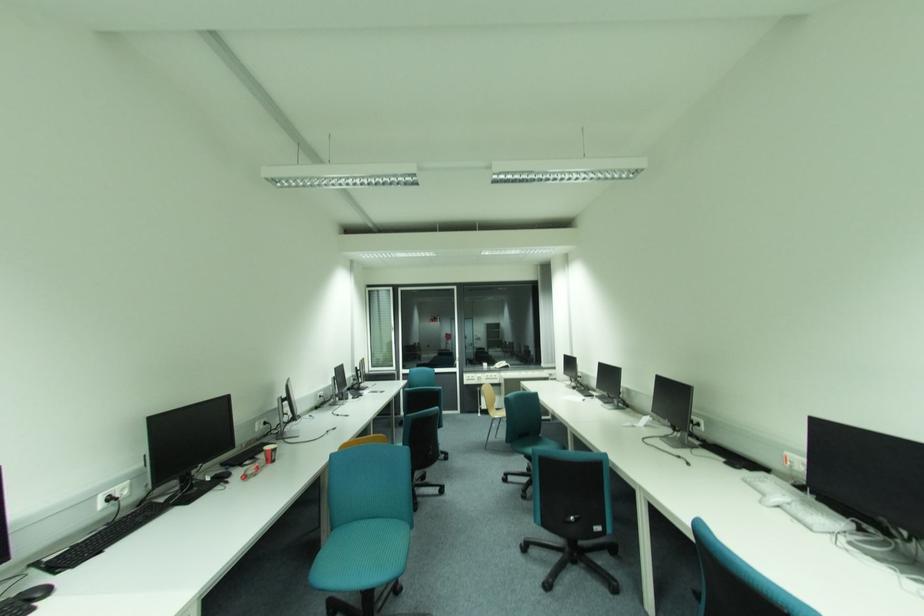
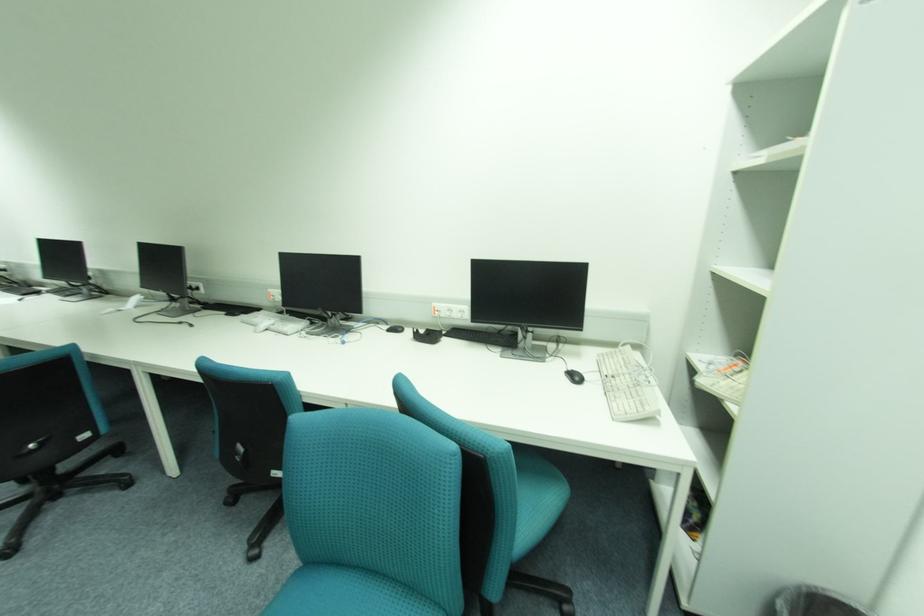
Where in the second image is the point corresponding to point 704,424 from the first image?

(203, 289)